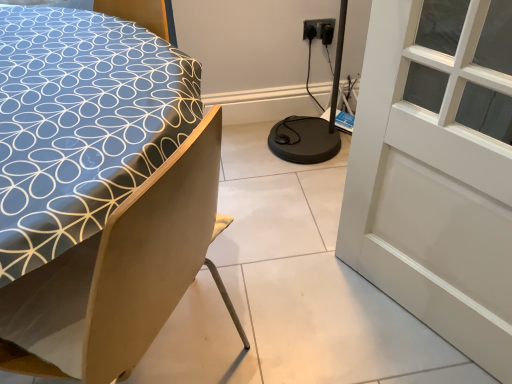
This screenshot has height=384, width=512. Identify the location of free point to the right of blue fabric bed at left. (318, 315).